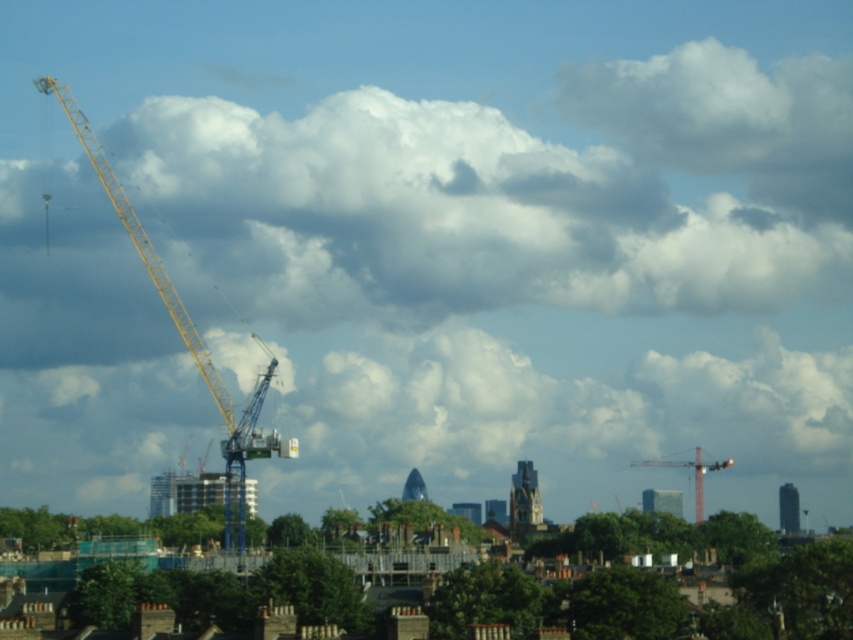
You are an architect observing the cityscape. You notice two cranes in the scene. Which one is taller, the yellow metallic crane at left or the metallic yellow crane at center?

The yellow metallic crane at left is taller than the metallic yellow crane at center.

You are an urban planner assessing the cityscape. You notice the blue metallic crane at left and the metallic yellow crane at center. Which crane has a greater height?

The blue metallic crane at left is taller than the metallic yellow crane at center.

You are standing at the point with coordinates (746, 570) in the cityscape. What object is located exactly at this point?

The blue metallic crane at left is located exactly at point (746, 570).